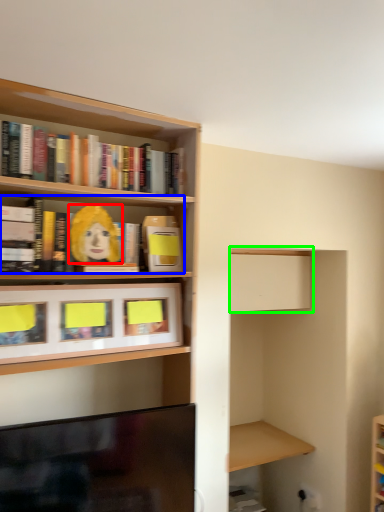
Question: Based on their relative distances, which object is farther from person (highlighted by a red box)? Choose from book (highlighted by a blue box) and cabinet (highlighted by a green box).

Choices:
 (A) book
 (B) cabinet

Answer: (B)